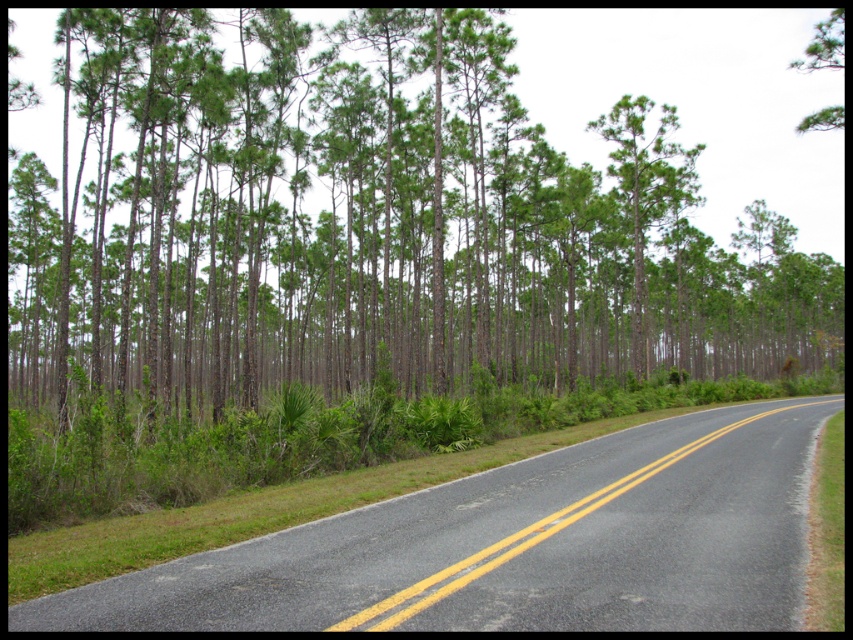
Question: Does green leafy trees at center come behind black asphalt road at center?

Choices:
 (A) no
 (B) yes

Answer: (B)

Question: Which point is closer to the camera taking this photo?

Choices:
 (A) (646, 516)
 (B) (164, 70)

Answer: (A)

Question: Which point is closer to the camera?

Choices:
 (A) (326, 326)
 (B) (700, 554)

Answer: (B)

Question: Does green leafy trees at center appear on the left side of black asphalt road at center?

Choices:
 (A) no
 (B) yes

Answer: (B)

Question: Does green leafy trees at center appear on the left side of black asphalt road at center?

Choices:
 (A) no
 (B) yes

Answer: (B)